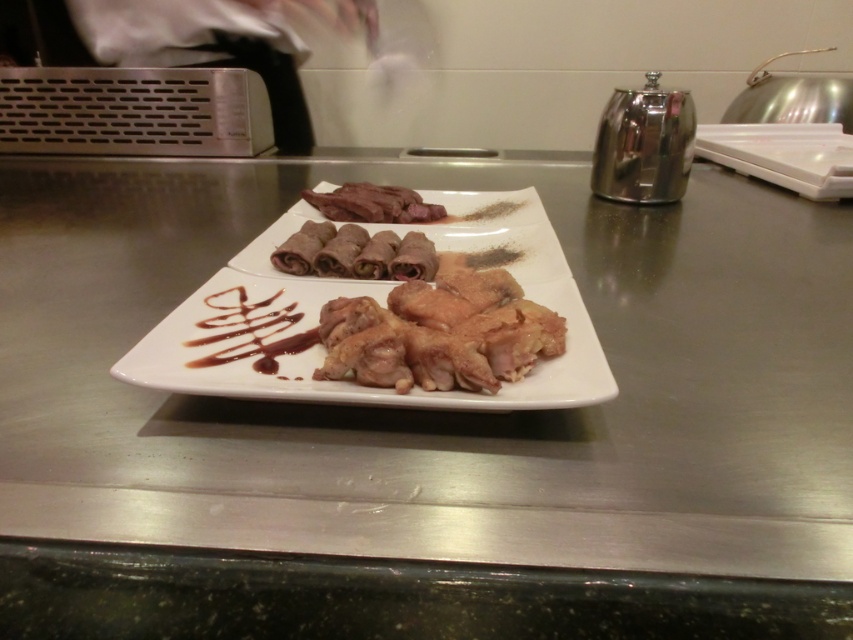
Question: Which point appears farthest from the camera in this image?

Choices:
 (A) (445, 310)
 (B) (430, 259)
 (C) (341, 12)

Answer: (C)

Question: Can you confirm if white glossy plate at center is positioned above matte brown meat rolls at center?

Choices:
 (A) no
 (B) yes

Answer: (A)

Question: Does white glossy plate at center have a larger size compared to golden brown crispy chicken at center?

Choices:
 (A) yes
 (B) no

Answer: (A)

Question: Considering the real-world distances, which object is farthest from the white glossy plate at center?

Choices:
 (A) white fabric at upper left
 (B) purple matte/soft meat rolls at center
 (C) dark brown glossy meat at center
 (D) metallic stainless steel counter at center

Answer: (A)

Question: Does white glossy plate at center appear on the left side of dark brown glossy meat at center?

Choices:
 (A) no
 (B) yes

Answer: (A)

Question: Which object is the farthest from the purple matte/soft meat rolls at center?

Choices:
 (A) golden brown crispy chicken at center
 (B) dark brown glossy meat at center

Answer: (B)